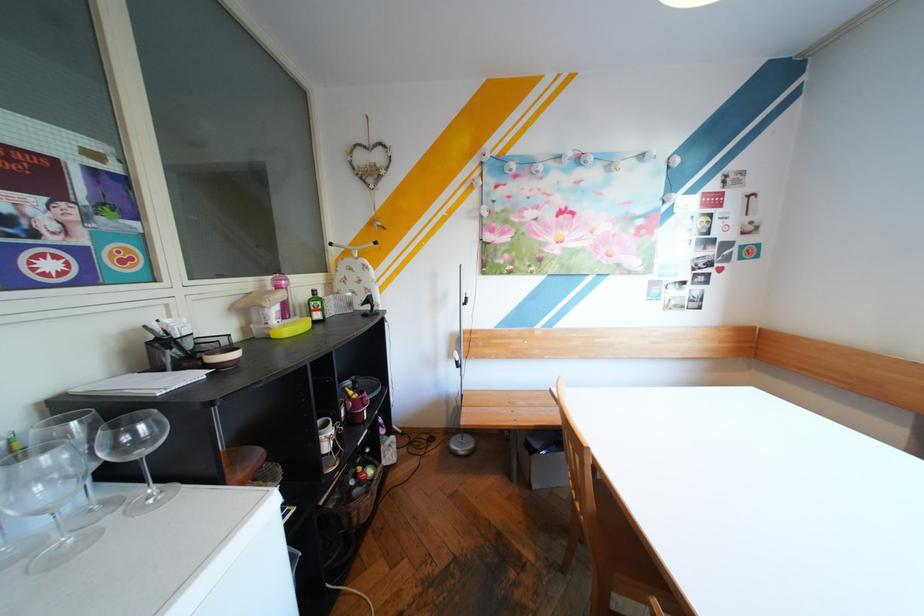
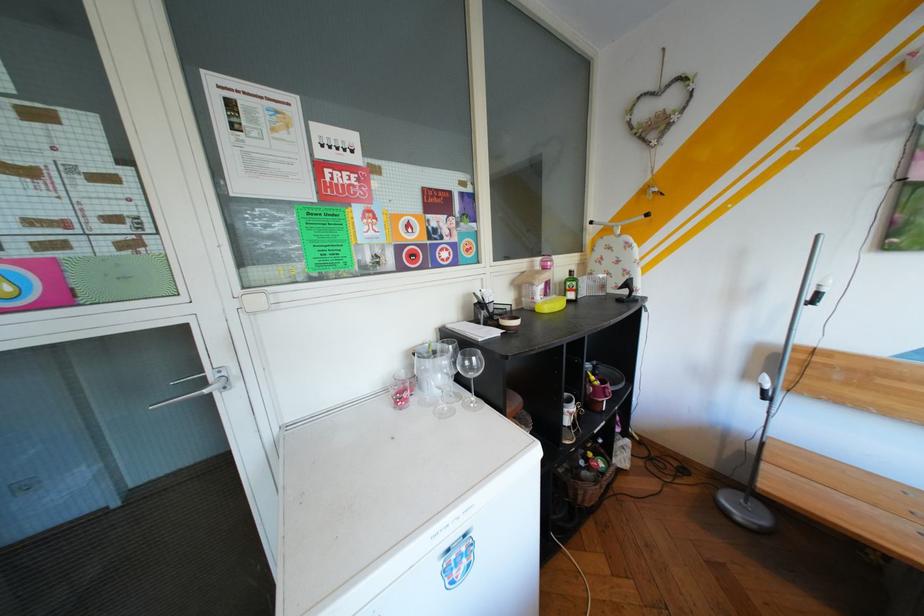
The point at (275, 306) is marked in the first image. Where is the corresponding point in the second image?

(545, 284)